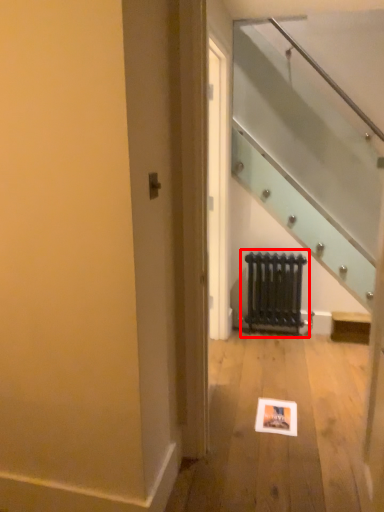
Question: From the image's perspective, what is the correct spatial relationship of radiator (annotated by the red box) in relation to picture frame?

Choices:
 (A) above
 (B) below

Answer: (A)